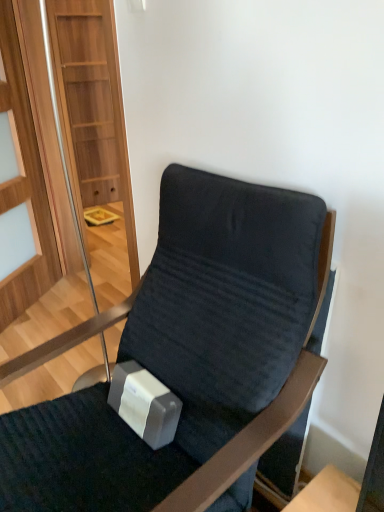
Question: Considering their positions, is velvet dark blue chair at center located in front of or behind transparent glass door at left?

Choices:
 (A) behind
 (B) front

Answer: (B)

Question: Is velvet dark blue chair at center inside or outside of transparent glass door at left?

Choices:
 (A) inside
 (B) outside

Answer: (B)

Question: From the image's perspective, is velvet dark blue chair at center located above or below transparent glass door at left?

Choices:
 (A) above
 (B) below

Answer: (B)

Question: Is transparent glass door at left bigger or smaller than velvet dark blue chair at center?

Choices:
 (A) big
 (B) small

Answer: (B)

Question: Is transparent glass door at left taller or shorter than velvet dark blue chair at center?

Choices:
 (A) tall
 (B) short

Answer: (A)

Question: Would you say transparent glass door at left is inside or outside velvet dark blue chair at center?

Choices:
 (A) inside
 (B) outside

Answer: (B)

Question: Does point (36, 175) appear closer or farther from the camera than point (192, 240)?

Choices:
 (A) farther
 (B) closer

Answer: (A)